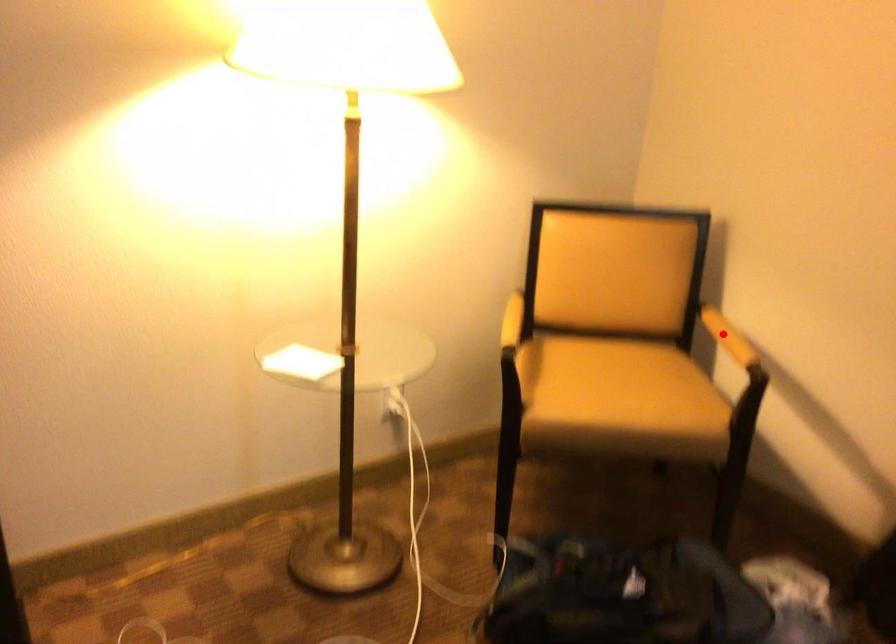
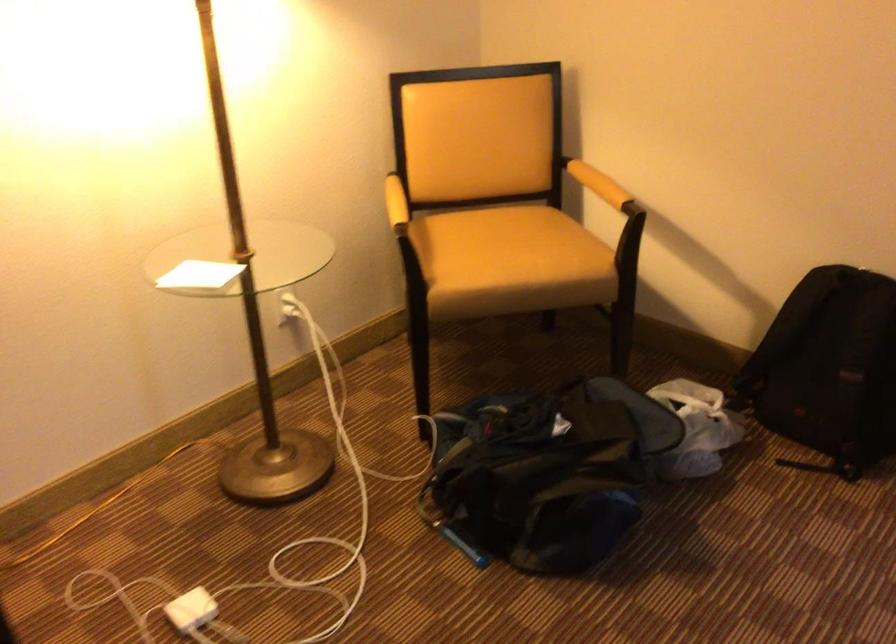
The point at the highlighted location is marked in the first image. Where is the corresponding point in the second image?

(598, 184)